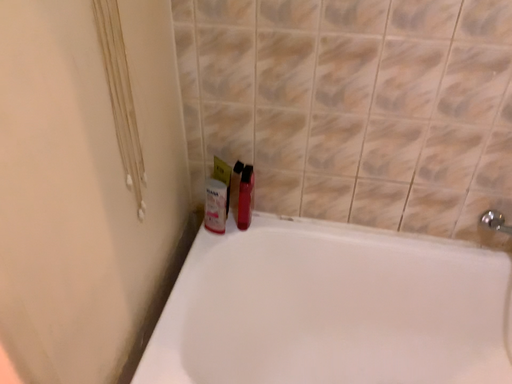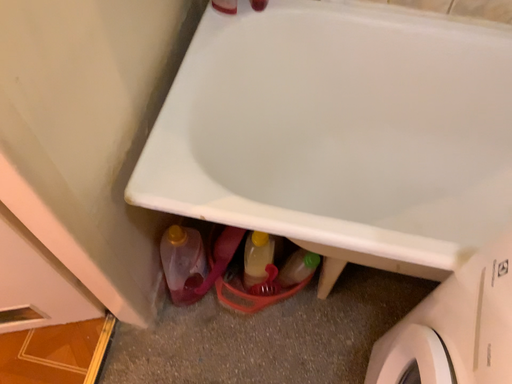
Question: Which way did the camera rotate in the video?

Choices:
 (A) rotated downward
 (B) rotated upward

Answer: (A)